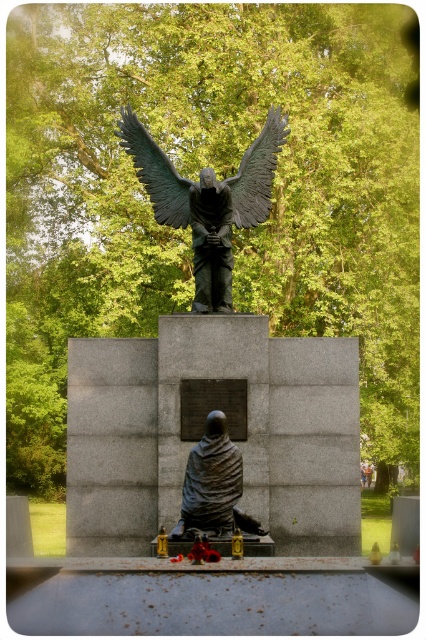
How distant is bronze statue at center from matte bronze statue at center?

bronze statue at center and matte bronze statue at center are 4.53 meters apart.

Which of these two, bronze statue at center or matte bronze statue at center, stands shorter?

With less height is matte bronze statue at center.

What do you see at coordinates (210, 380) in the screenshot?
I see `bronze statue at center` at bounding box center [210, 380].

You are a GUI agent. You are given a task and a screenshot of the screen. Output one action in this format:
    pyautogui.click(x=<x>, y=<y>)
    Task: Click on the bronze statue at center
    
    Given the screenshot: What is the action you would take?
    pyautogui.click(x=210, y=380)

Which of these two, matte bronze statue at center or green patina wings at upper center, stands shorter?

matte bronze statue at center is shorter.

Measure the distance between matte bronze statue at center and green patina wings at upper center.

They are 15.62 meters apart.

Which is behind, point (203, 509) or point (143, 177)?

The point (143, 177) is behind.

The image size is (426, 640). In order to click on matte bronze statue at center in this screenshot , I will do `click(213, 486)`.

Is bronze statue at center to the right of shiny bronze wings at upper center from the viewer's perspective?

No, bronze statue at center is not to the right of shiny bronze wings at upper center.

Image resolution: width=426 pixels, height=640 pixels. What do you see at coordinates (210, 380) in the screenshot? I see `bronze statue at center` at bounding box center [210, 380].

Where is `bronze statue at center`? bronze statue at center is located at coordinates (210, 380).